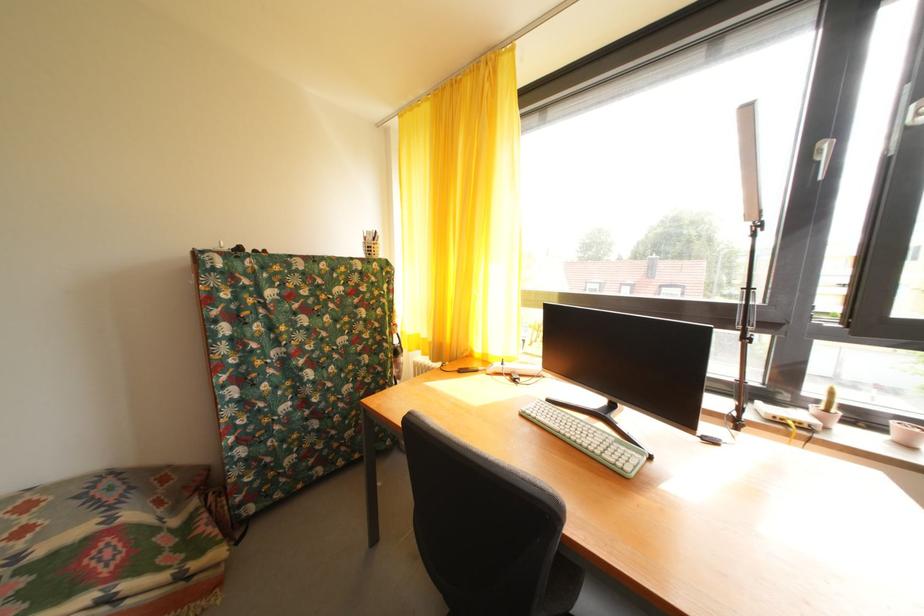
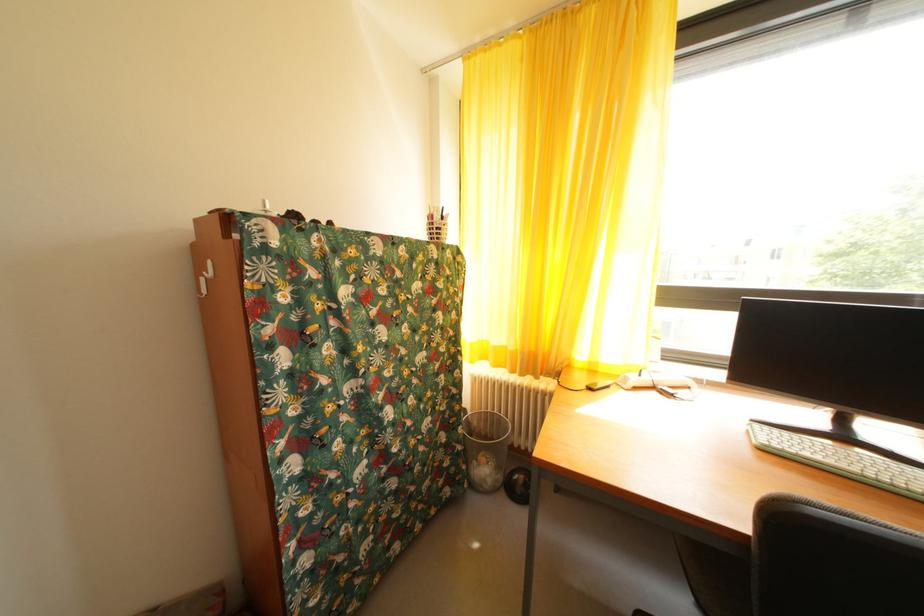
Where in the second image is the point corresponding to the point at 565,432 from the first image?

(854, 472)